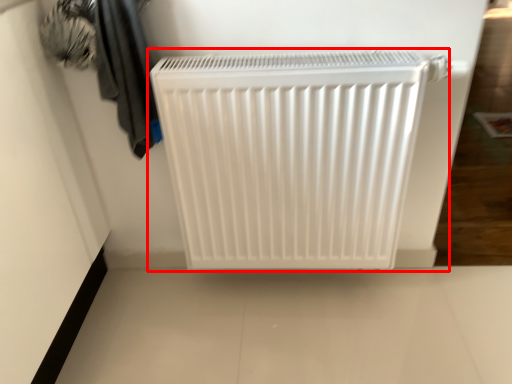
Question: From the image's perspective, where is home appliance (annotated by the red box) located in relation to laundry in the image?

Choices:
 (A) below
 (B) above

Answer: (A)